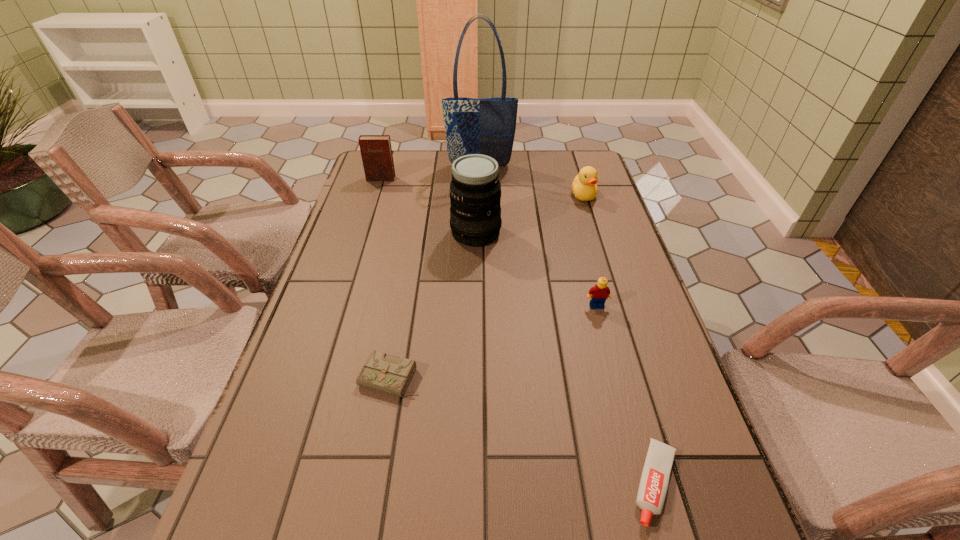
Identify the location of object that stands as the fifth closest to the farthest object. The image size is (960, 540). (380, 372).

At what (x,y) coordinates should I click in order to perform the action: click on vacant area that satisfies the following two spatial constraints: 1. on the front cover of the leftmost object; 2. on the right side of the second nearest object. Please return your answer as a coordinate pair (x, y). The width and height of the screenshot is (960, 540). Looking at the image, I should click on (318, 378).

Find the location of a particular element. vacant area in the image that satisfies the following two spatial constraints: 1. on the front side of the second tallest object; 2. on the right side of the toothpaste is located at coordinates click(x=473, y=483).

The image size is (960, 540). I want to click on vacant space that satisfies the following two spatial constraints: 1. on the front-facing side of the toothpaste; 2. on the left side of the fifth tallest object, so click(x=643, y=483).

Identify the location of free region that satisfies the following two spatial constraints: 1. on the front cover of the second tallest object; 2. on the left side of the farther diary. This screenshot has width=960, height=540. (364, 233).